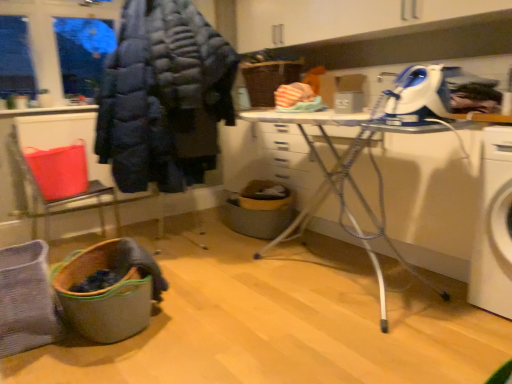
Where is `free space below dark blue puffer jacket at upper left (from a real-world perspective)`? The width and height of the screenshot is (512, 384). free space below dark blue puffer jacket at upper left (from a real-world perspective) is located at coordinates (186, 243).